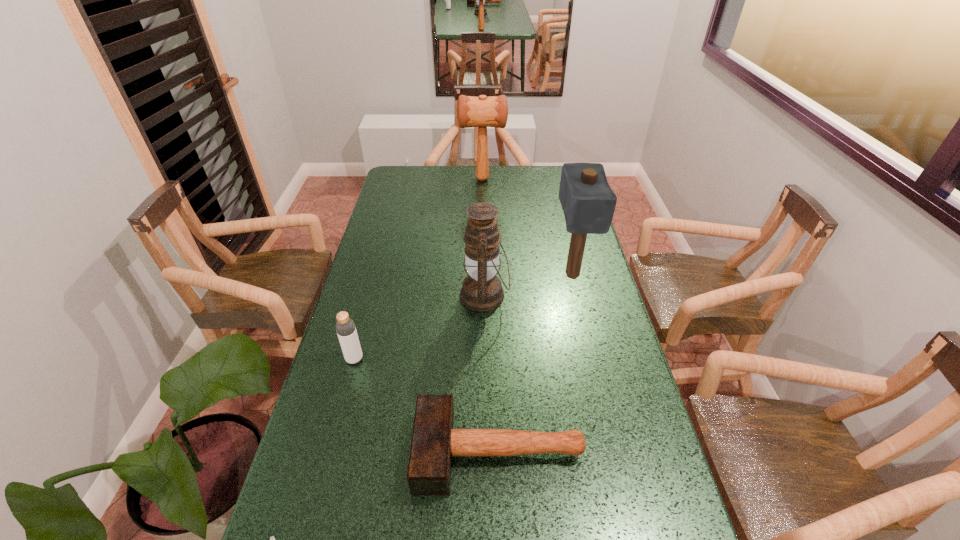
Locate an element on the screen. Image resolution: width=960 pixels, height=540 pixels. the rightmost mallet is located at coordinates (588, 202).

Where is `the second nearest mallet`? The image size is (960, 540). the second nearest mallet is located at coordinates (588, 202).

Where is `the farthest mallet`? Image resolution: width=960 pixels, height=540 pixels. the farthest mallet is located at coordinates click(482, 112).

This screenshot has height=540, width=960. I want to click on oil lamp, so click(x=481, y=290).

This screenshot has height=540, width=960. What are the coordinates of `the fourth tallest object` in the screenshot? It's located at (345, 327).

Find the location of a particular element. The width and height of the screenshot is (960, 540). the third nearest object is located at coordinates point(345,327).

The width and height of the screenshot is (960, 540). Identify the location of the shortest mallet. (434, 441).

Find the location of a particular element. The image size is (960, 540). the second nearest object is located at coordinates (434, 441).

Image resolution: width=960 pixels, height=540 pixels. Find the location of `vacant region located 0.390m on the front of the rightmost mallet`. vacant region located 0.390m on the front of the rightmost mallet is located at coordinates (602, 396).

Where is `vacant space located 0.050m on the strike surface of the farthest mallet`? vacant space located 0.050m on the strike surface of the farthest mallet is located at coordinates (448, 179).